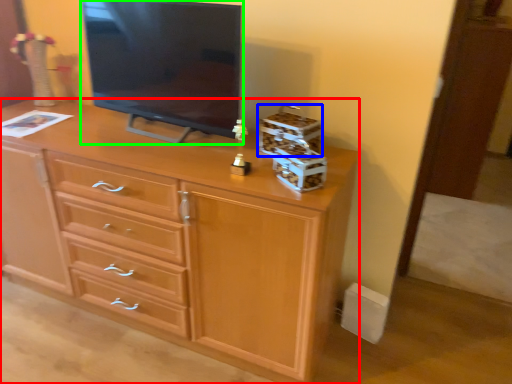
Question: Which object is positioned farthest from chest of drawers (highlighted by a red box)? Select from storage box (highlighted by a blue box) and television (highlighted by a green box).

Choices:
 (A) storage box
 (B) television

Answer: (A)